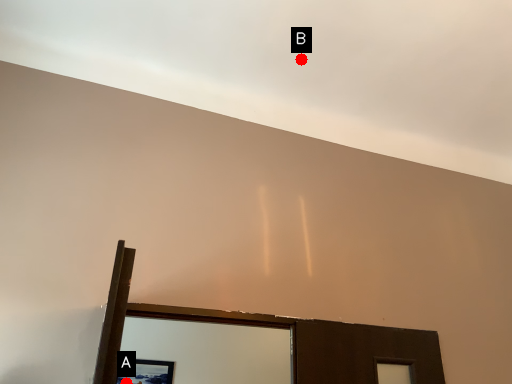
Question: Two points are circled on the image, labeled by A and B beside each circle. Among these points, which one is nearest to the camera?

Choices:
 (A) A is closer
 (B) B is closer

Answer: (B)